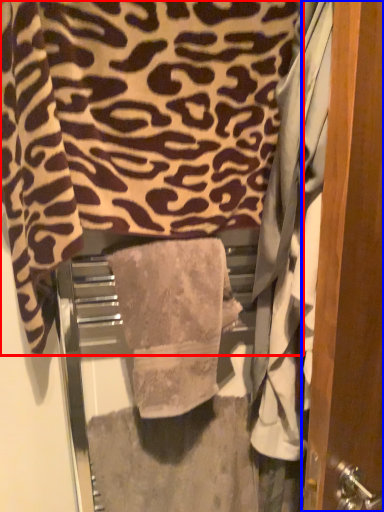
Question: Which point is closer to the camera, towel (highlighted by a red box) or door (highlighted by a blue box)?

Choices:
 (A) towel
 (B) door

Answer: (B)